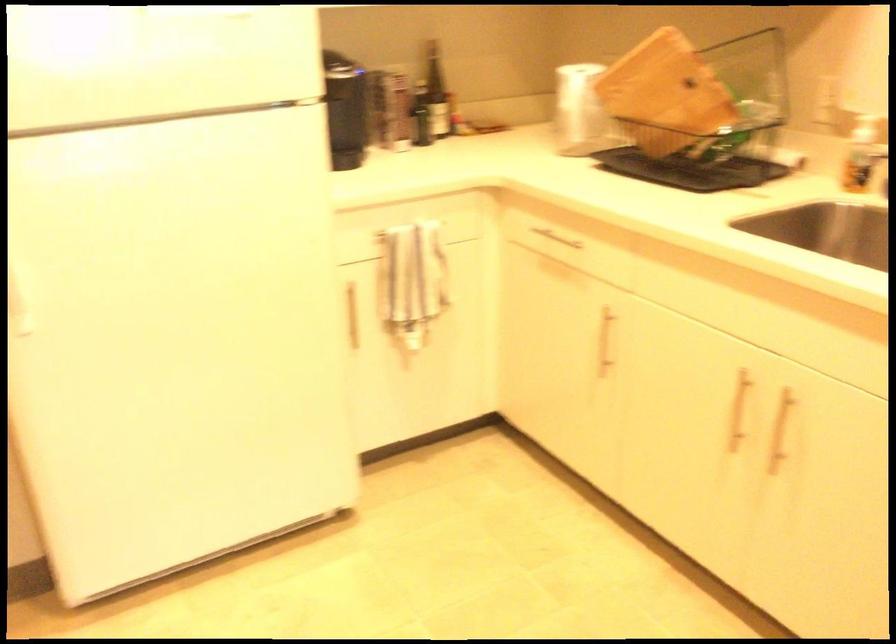
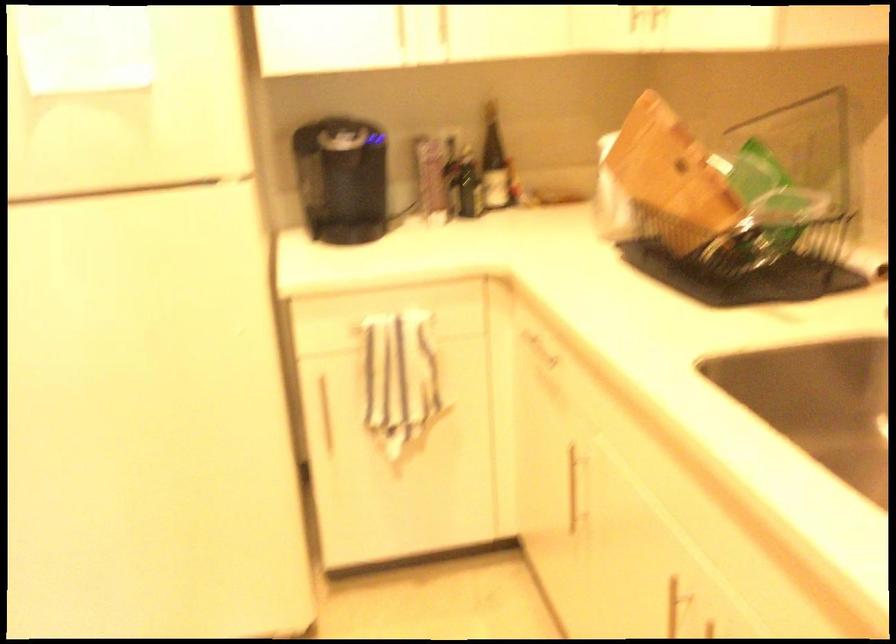
Locate, in the second image, the point that corresponds to [348,313] in the first image.

(323, 412)